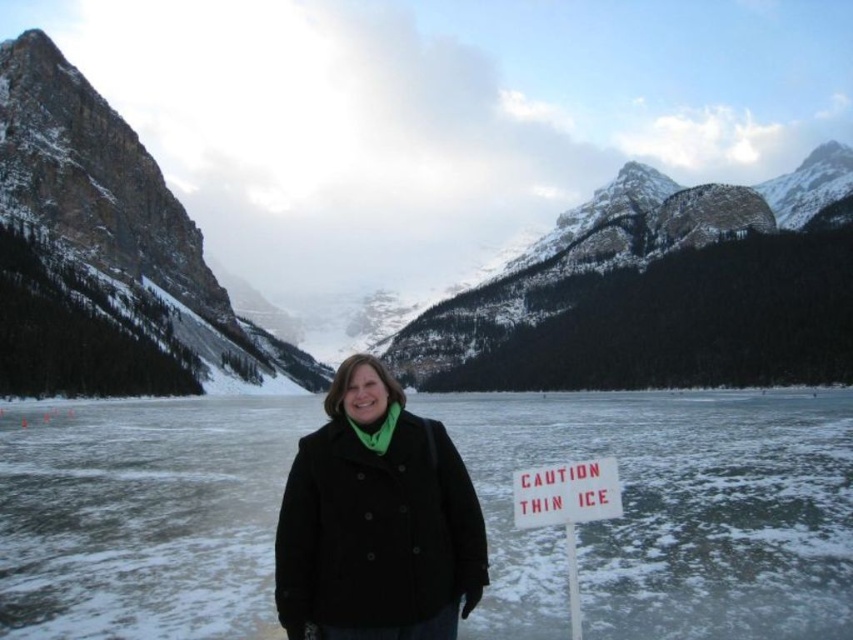
Does white ice at center have a lesser width compared to snowy rock mountain at upper center?

Yes, white ice at center is thinner than snowy rock mountain at upper center.

Which of these two, white ice at center or snowy rock mountain at upper center, stands taller?

With more height is snowy rock mountain at upper center.

Is point (136, 420) closer to camera compared to point (444, 340)?

Yes, point (136, 420) is in front of point (444, 340).

Where is `white ice at center`? white ice at center is located at coordinates (669, 513).

Can you confirm if snowy rock mountain at upper center is wider than black wool coat at center?

Indeed, snowy rock mountain at upper center has a greater width compared to black wool coat at center.

Who is taller, snowy rock mountain at upper center or black wool coat at center?

snowy rock mountain at upper center is taller.

The height and width of the screenshot is (640, 853). Find the location of `snowy rock mountain at upper center`. snowy rock mountain at upper center is located at coordinates (109, 196).

This screenshot has width=853, height=640. Identify the location of snowy rock mountain at upper center. (109, 196).

Find the location of `black wool coat at center`. black wool coat at center is located at coordinates (376, 518).

Does black wool coat at center come in front of white plastic sign at lower right?

That is True.

What do you see at coordinates (376, 518) in the screenshot? I see `black wool coat at center` at bounding box center [376, 518].

Locate an element on the screen. The image size is (853, 640). black wool coat at center is located at coordinates (376, 518).